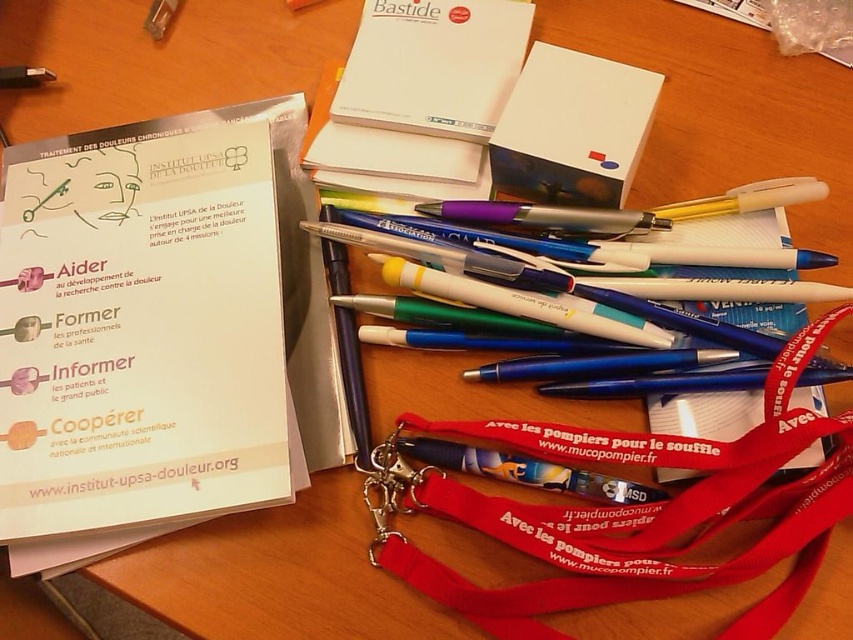
Question: Is red fabric lanyard at center below white paper notepad at upper center?

Choices:
 (A) yes
 (B) no

Answer: (A)

Question: Which object is closer to the camera taking this photo?

Choices:
 (A) white paper notepad at upper center
 (B) red fabric lanyard at center

Answer: (B)

Question: Does red fabric lanyard at center have a smaller size compared to white paper notepad at upper center?

Choices:
 (A) yes
 (B) no

Answer: (B)

Question: Which of the following is the farthest from the observer?

Choices:
 (A) red fabric lanyard at center
 (B) white paper notepad at upper center

Answer: (B)

Question: Can you confirm if red fabric lanyard at center is positioned to the right of white paper notepad at upper center?

Choices:
 (A) yes
 (B) no

Answer: (A)